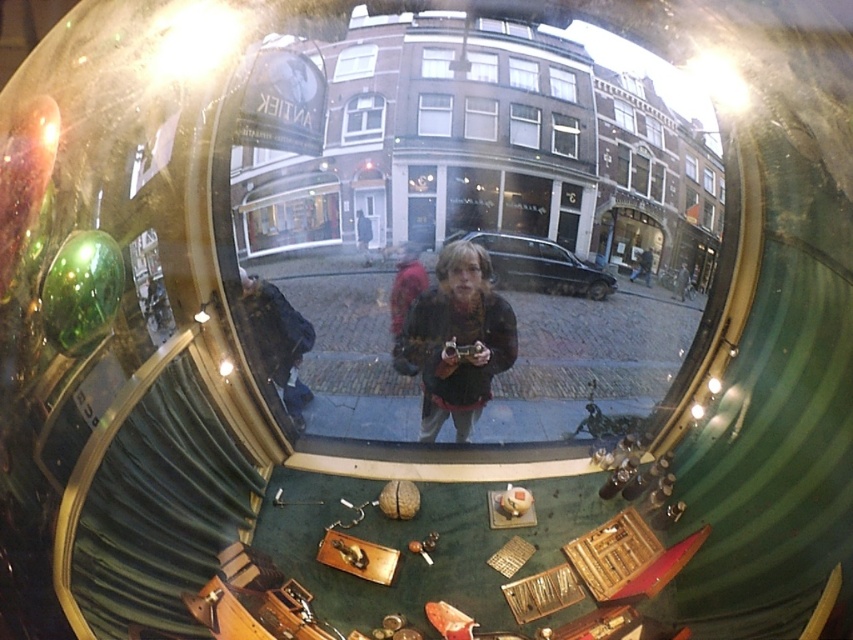
Question: Which point is closer to the camera?

Choices:
 (A) matte black camera at center
 (B) matte black jacket at center
 (C) dark blue jacket at center

Answer: (A)

Question: Does matte black jacket at center come behind dark blue jacket at center?

Choices:
 (A) yes
 (B) no

Answer: (B)

Question: Which object appears closest to the camera in this image?

Choices:
 (A) matte black jacket at center
 (B) matte black camera at center

Answer: (B)

Question: Which point is farther from the camera taking this photo?

Choices:
 (A) (288, 316)
 (B) (451, 298)

Answer: (A)

Question: Considering the relative positions of matte black jacket at center and dark blue jacket at center in the image provided, where is matte black jacket at center located with respect to dark blue jacket at center?

Choices:
 (A) above
 (B) below

Answer: (A)

Question: Can you confirm if matte black camera at center is wider than dark blue jacket at center?

Choices:
 (A) yes
 (B) no

Answer: (A)